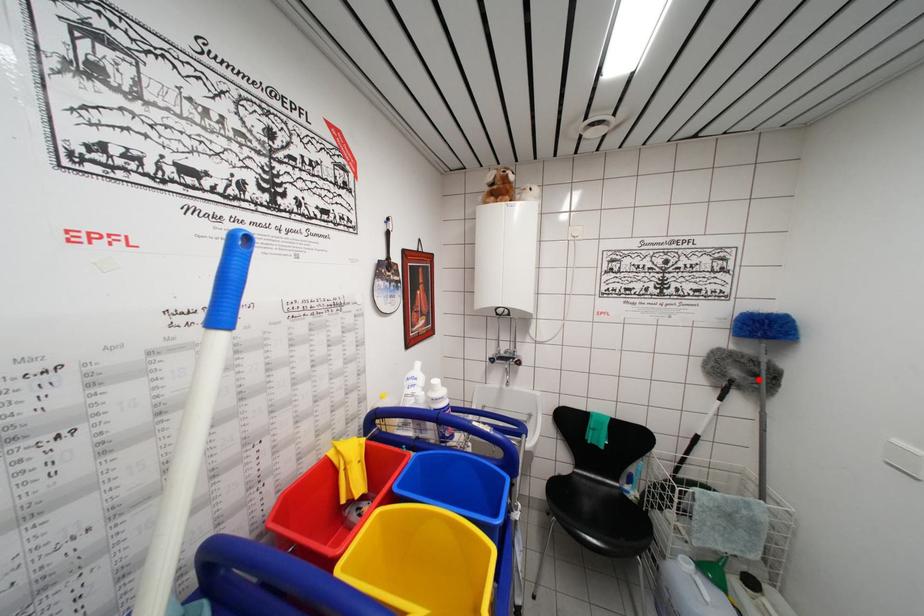
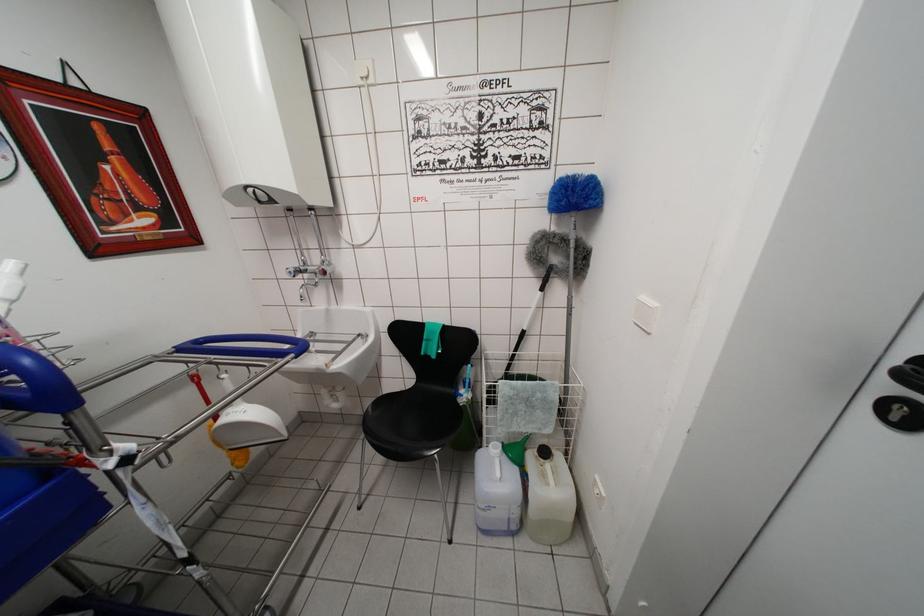
Where in the second image is the point corresponding to the highlighted location from the first image?

(572, 261)